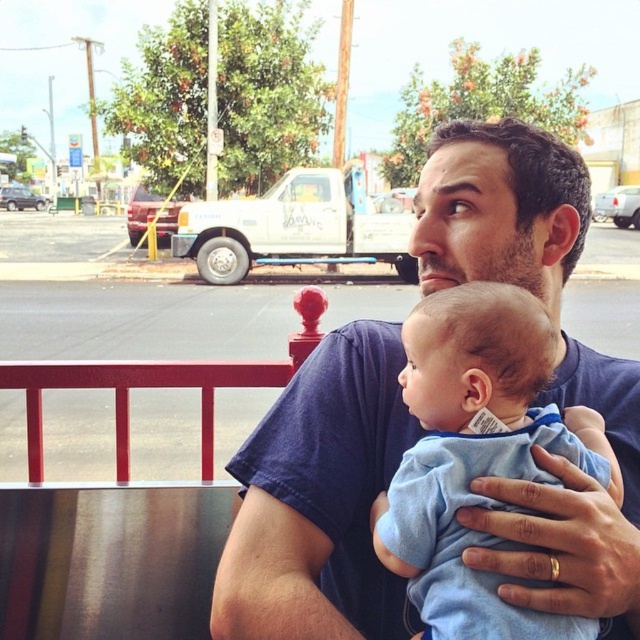
Is blue cotton shirt at center taller than blue soft fabric baby at center?

Yes, blue cotton shirt at center is taller than blue soft fabric baby at center.

At what (x,y) coordinates should I click in order to perform the action: click on blue cotton shirt at center. Please return your answer as a coordinate pair (x, y). The image size is (640, 640). Looking at the image, I should click on (320, 500).